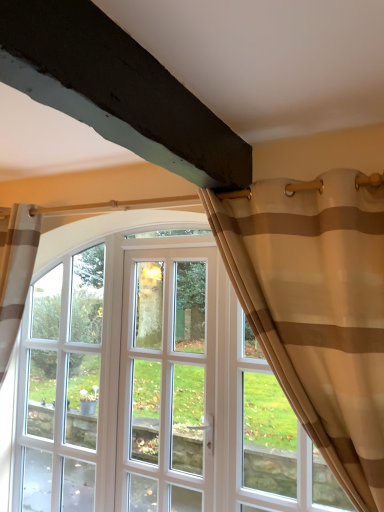
The image size is (384, 512). Describe the element at coordinates (62, 385) in the screenshot. I see `clear glass window at center` at that location.

In order to face beige sheer curtain at upper right, should I rotate leftwards or rightwards?

A 12.070 degree turn to the right will do.

Find the location of a particular element. The image size is (384, 512). clear glass window at center is located at coordinates (62, 385).

From the image's perspective, is beige sheer curtain at upper right beneath white glass door at center?

No.

Which is correct: beige sheer curtain at upper right is inside white glass door at center, or outside of it?

beige sheer curtain at upper right exists outside the volume of white glass door at center.

Relative to white glass door at center, is beige sheer curtain at upper right in front or behind?

beige sheer curtain at upper right is positioned closer to the viewer than white glass door at center.

I want to click on screen door behind the beige sheer curtain at upper right, so click(167, 381).

From a real-world perspective, is beige sheer curtain at upper right physically located above or below clear glass window at center?

In terms of real-world spatial position, beige sheer curtain at upper right is above clear glass window at center.

Is clear glass window at center at the back of beige sheer curtain at upper right?

That's not correct — beige sheer curtain at upper right is not looking away from clear glass window at center.

Based on the photo, between beige sheer curtain at upper right and clear glass window at center, which one has larger width?

beige sheer curtain at upper right.

In the scene shown: How different are the orientations of beige sheer curtain at upper right and clear glass window at center in degrees?

The facing directions of beige sheer curtain at upper right and clear glass window at center are 0.568 degrees apart.

Does clear glass window at center come in front of white glass door at center?

No, it is behind white glass door at center.

What's the angular difference between clear glass window at center and white glass door at center's facing directions?

The facing directions of clear glass window at center and white glass door at center are 0.00336 degrees apart.

Does point (25, 465) appear closer or farther from the camera than point (163, 396)?

Point (25, 465) is farther from the camera than point (163, 396).

Does clear glass window at center touch white glass door at center?

They are not placed beside each other.

Which of these two, white glass door at center or beige sheer curtain at upper right, is bigger?

beige sheer curtain at upper right is bigger.

Is point (177, 382) in front of point (376, 285)?

No, it is behind (376, 285).

Which object is further away from the camera, white glass door at center or beige sheer curtain at upper right?

white glass door at center is behind.

From a real-world perspective, does white glass door at center stand above clear glass window at center?

Correct, in the physical world, white glass door at center is higher than clear glass window at center.

How far apart are white glass door at center and clear glass window at center?

white glass door at center and clear glass window at center are 21.61 inches apart.

Is white glass door at center positioned beyond the bounds of clear glass window at center?

white glass door at center is positioned outside clear glass window at center.

Can you tell me how much white glass door at center and clear glass window at center differ in facing direction?

white glass door at center and clear glass window at center are facing 0.00336 degrees away from each other.

Considering the positions of objects clear glass window at center and beige sheer curtain at upper right in the image provided, who is behind, clear glass window at center or beige sheer curtain at upper right?

clear glass window at center is further from the camera.

Is point (91, 500) closer to camera compared to point (326, 198)?

No, it is behind (326, 198).

Is clear glass window at center not close to beige sheer curtain at upper right?

clear glass window at center is positioned a significant distance from beige sheer curtain at upper right.

Can you confirm if clear glass window at center is positioned to the right of beige sheer curtain at upper right?

No, clear glass window at center is not to the right of beige sheer curtain at upper right.

This screenshot has width=384, height=512. I want to click on curtain that appears above the white glass door at center (from a real-world perspective), so click(317, 311).

Where is `window behind the beige sheer curtain at upper right`? The width and height of the screenshot is (384, 512). window behind the beige sheer curtain at upper right is located at coordinates pos(62,385).

Looking at this image, which object lies nearer to the anchor point beige sheer curtain at upper right, clear glass window at center or white glass door at center?

white glass door at center is closer to beige sheer curtain at upper right.

When comparing their distances from white glass door at center, does beige sheer curtain at upper right or clear glass window at center seem closer?

clear glass window at center.

Looking at the image, which one is located closer to clear glass window at center, beige sheer curtain at upper right or white glass door at center?

white glass door at center is closer to clear glass window at center.

Based on their spatial positions, is white glass door at center or beige sheer curtain at upper right further from clear glass window at center?

beige sheer curtain at upper right lies further to clear glass window at center than the other object.

Which object lies nearer to the anchor point beige sheer curtain at upper right, white glass door at center or clear glass window at center?

white glass door at center is closer to beige sheer curtain at upper right.

From the image, which object appears to be nearer to white glass door at center, clear glass window at center or beige sheer curtain at upper right?

clear glass window at center.

At what (x,y) coordinates should I click in order to perform the action: click on screen door located between beige sheer curtain at upper right and clear glass window at center in the depth direction. Please return your answer as a coordinate pair (x, y). Image resolution: width=384 pixels, height=512 pixels. Looking at the image, I should click on (167, 381).